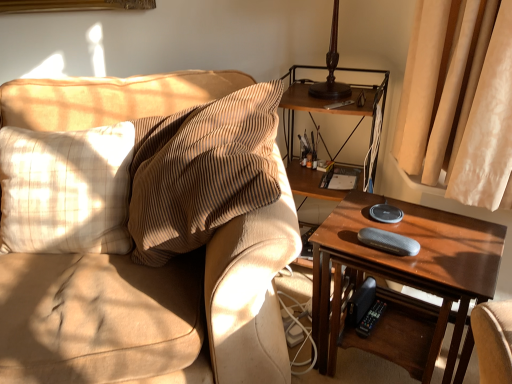
Question: Can you confirm if wooden shelf at right is thinner than wooden table at right?

Choices:
 (A) no
 (B) yes

Answer: (B)

Question: From the image's perspective, is wooden shelf at right located beneath wooden table at right?

Choices:
 (A) no
 (B) yes

Answer: (A)

Question: From a real-world perspective, is wooden shelf at right on top of wooden table at right?

Choices:
 (A) no
 (B) yes

Answer: (B)

Question: Is wooden shelf at right to the right of wooden table at right from the viewer's perspective?

Choices:
 (A) no
 (B) yes

Answer: (A)

Question: Would you say wooden shelf at right contains wooden table at right?

Choices:
 (A) yes
 (B) no

Answer: (B)

Question: Is textured beige couch at left situated inside beige plaid pillow at left or outside?

Choices:
 (A) inside
 (B) outside

Answer: (B)

Question: Would you say textured beige couch at left is to the left or to the right of beige plaid pillow at left in the picture?

Choices:
 (A) left
 (B) right

Answer: (B)

Question: Considering their positions, is textured beige couch at left located in front of or behind beige plaid pillow at left?

Choices:
 (A) behind
 (B) front

Answer: (B)

Question: In terms of size, does textured beige couch at left appear bigger or smaller than beige plaid pillow at left?

Choices:
 (A) small
 (B) big

Answer: (B)

Question: Is wooden shelf at right situated inside beige plaid pillow at left or outside?

Choices:
 (A) inside
 (B) outside

Answer: (B)

Question: Considering the positions of wooden shelf at right and beige plaid pillow at left in the image, is wooden shelf at right taller or shorter than beige plaid pillow at left?

Choices:
 (A) tall
 (B) short

Answer: (A)

Question: Is point (303, 87) closer or farther from the camera than point (103, 160)?

Choices:
 (A) farther
 (B) closer

Answer: (A)

Question: From the image's perspective, is wooden shelf at right positioned above or below beige plaid pillow at left?

Choices:
 (A) below
 (B) above

Answer: (B)

Question: In terms of width, does beige plaid pillow at left look wider or thinner when compared to wooden shelf at right?

Choices:
 (A) wide
 (B) thin

Answer: (A)

Question: From the image's perspective, is beige plaid pillow at left above or below wooden shelf at right?

Choices:
 (A) above
 (B) below

Answer: (B)